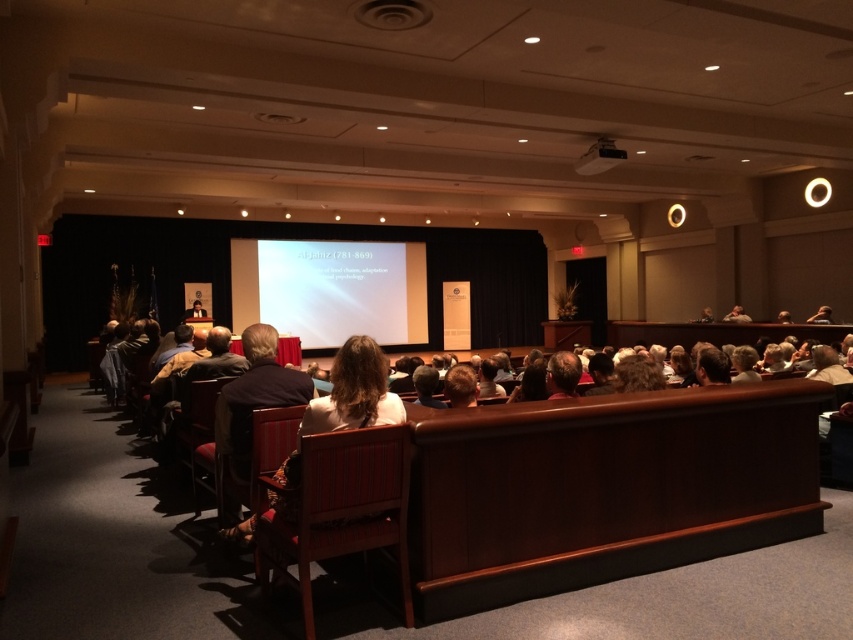
Who is positioned more to the right, wooden chair at center or white matte projection screen at center?

From the viewer's perspective, wooden chair at center appears more on the right side.

Between wooden chair at center and white matte projection screen at center, which one is positioned higher?

white matte projection screen at center

The height and width of the screenshot is (640, 853). Identify the location of wooden chair at center. (341, 508).

Find the location of a particular element. The height and width of the screenshot is (640, 853). wooden chair at center is located at coordinates (341, 508).

Which is below, white fabric chair at center or black plastic projector at upper center?

white fabric chair at center is below.

Which is in front, point (374, 362) or point (585, 172)?

Point (374, 362) is in front.

Identify the location of white fabric chair at center. (354, 392).

Is point (299, 301) positioned after point (380, 424)?

That is True.

Is white matte projection screen at center thinner than white fabric chair at center?

In fact, white matte projection screen at center might be wider than white fabric chair at center.

Is point (270, 246) behind point (287, 484)?

Yes, point (270, 246) is behind point (287, 484).

Find the location of `white matte projection screen at center`. white matte projection screen at center is located at coordinates (331, 289).